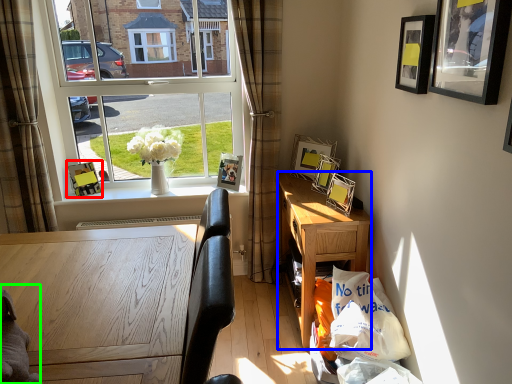
Question: Considering the real-world distances, which object is farthest from picture frame (highlighted by a red box)? desk (highlighted by a blue box) or animal (highlighted by a green box)?

Choices:
 (A) desk
 (B) animal

Answer: (B)